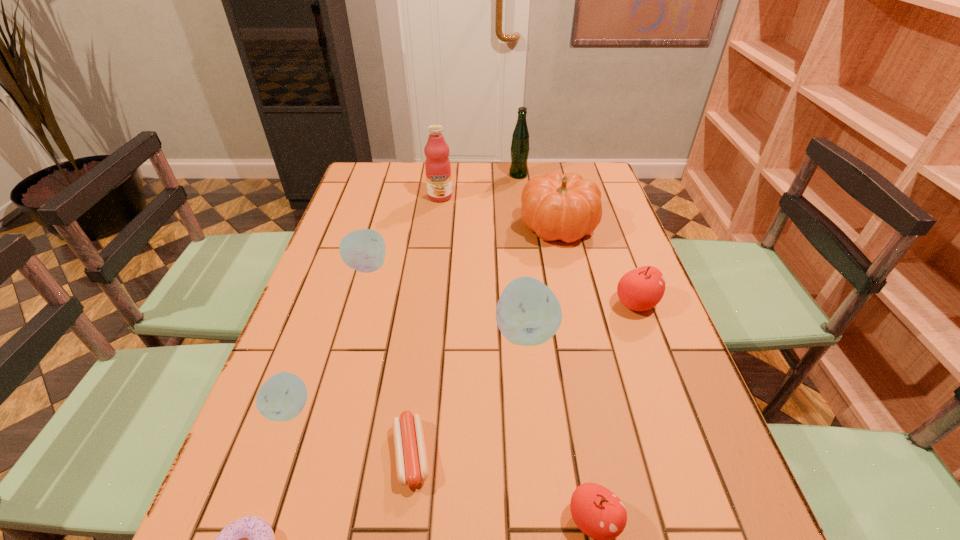
I want to click on vacant point located on the back of the right red apple, so click(611, 234).

Locate an element on the screen. The height and width of the screenshot is (540, 960). vacant space located on the right of the fourth farthest apple is located at coordinates (440, 409).

Find the location of a particular element. The width and height of the screenshot is (960, 540). free point located on the right of the sausage is located at coordinates (588, 454).

Find the location of a particular element. Image resolution: width=960 pixels, height=540 pixels. beer bottle that is at the far edge is located at coordinates tap(520, 148).

Identify the location of fruit juice positioned at the far edge. The width and height of the screenshot is (960, 540). (437, 165).

Identify the location of pumpkin that is at the right edge. (566, 207).

The image size is (960, 540). I want to click on apple that is at the right edge, so click(x=642, y=288).

The image size is (960, 540). I want to click on free space at the far edge, so click(491, 188).

In the image, there is a desktop. Where is `free region at the left edge`? Image resolution: width=960 pixels, height=540 pixels. free region at the left edge is located at coordinates (334, 253).

Locate an element on the screen. free space at the right edge is located at coordinates (674, 387).